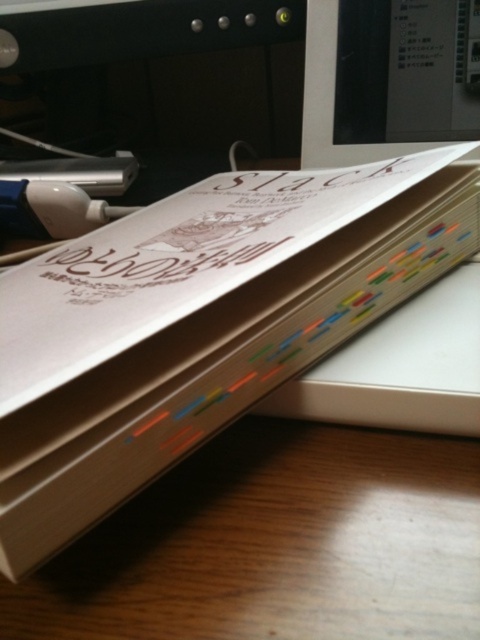
You are organizing a desk and need to know if the beige paper book at center can be placed next to the matte plastic computer monitor at upper right without overlapping. Based on their widths, will they fit side by side?

The beige paper book at center is wider than the matte plastic computer monitor at upper right, so they can fit side by side as long as there is enough space on the desk to accommodate both their widths.

You are holding a ruler and want to measure the distance between your eyes and the point at coordinates point (375,209) in the image. What is the approximate distance in inches?

The point at coordinates point (375,209) is 16.08 inches away from the viewer, so the approximate distance is 16.08 inches.